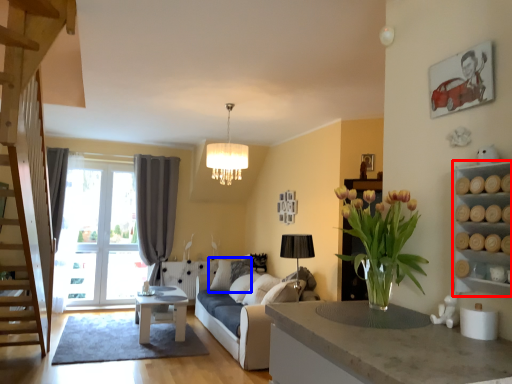
Question: Which object appears closest to the camera in this image, cabinet (highlighted by a red box) or pillow (highlighted by a blue box)?

Choices:
 (A) cabinet
 (B) pillow

Answer: (A)